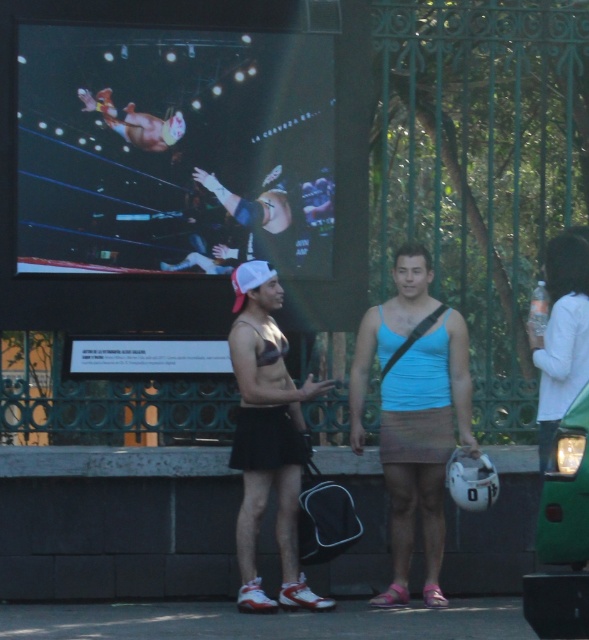
You are at an outdoor event and see two people dressed in light blue tank top at center and white cotton shirt at right. Which one is closer to the ground?

The light blue tank top at center is closer to the ground because it is positioned under the white cotton shirt at right.

You are standing in the outdoor scene and want to take a photo of both the black matte shorts at center and the white cotton shirt at right. Which one should you focus on first to ensure both are in clear view?

You should focus on the black matte shorts at center first because it is closer to you than the white cotton shirt at right, ensuring both will be in clear view when focused on the closer object.